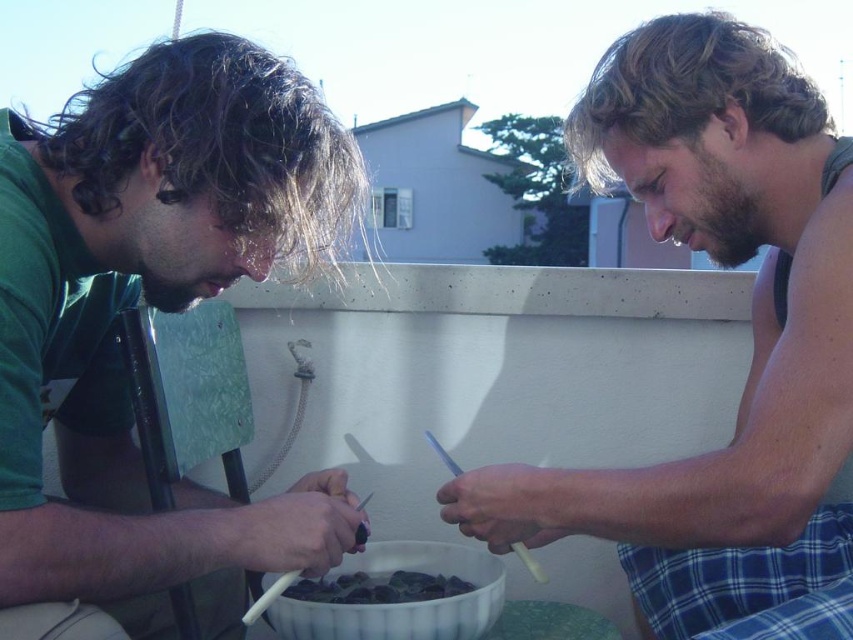
Question: Can you confirm if smooth skin man at center is bigger than dark green glossy shells at center?

Choices:
 (A) no
 (B) yes

Answer: (B)

Question: Among these points, which one is farthest from the camera?

Choices:
 (A) (590, 481)
 (B) (323, 593)
 (C) (64, 241)

Answer: (B)

Question: Considering the relative positions of green matte shirt at left and smooth skin man at center in the image provided, where is green matte shirt at left located with respect to smooth skin man at center?

Choices:
 (A) left
 (B) right

Answer: (A)

Question: Among these objects, which one is farthest from the camera?

Choices:
 (A) green matte shirt at left
 (B) dark green glossy shells at center

Answer: (B)

Question: Is green matte shirt at left positioned in front of dark green glossy shells at center?

Choices:
 (A) no
 (B) yes

Answer: (B)

Question: Which object is the closest to the dark green glossy shells at center?

Choices:
 (A) smooth skin man at center
 (B) green matte shirt at left

Answer: (B)